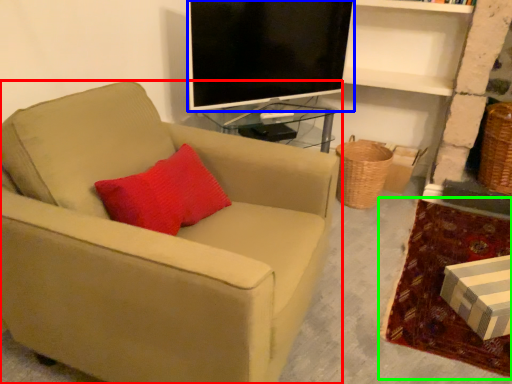
Question: Considering the real-world distances, which object is closest to chair (highlighted by a red box)? television (highlighted by a blue box) or plain (highlighted by a green box).

Choices:
 (A) television
 (B) plain

Answer: (A)